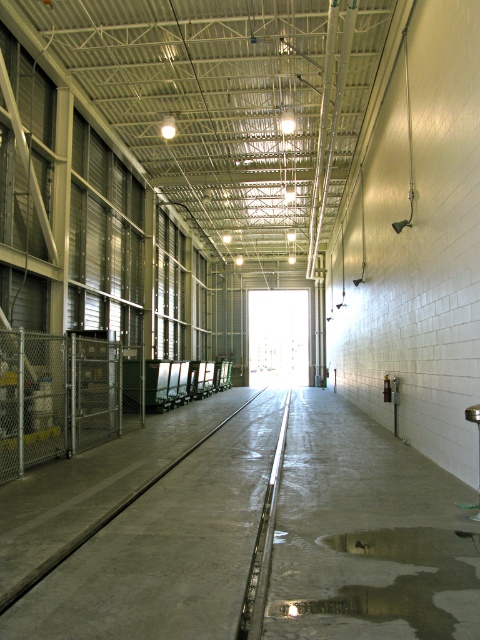
This screenshot has width=480, height=640. What do you see at coordinates (167, 548) in the screenshot?
I see `gray concrete rail at center` at bounding box center [167, 548].

Is gray concrete rail at center shorter than black metal rail at center?

Correct, gray concrete rail at center is not as tall as black metal rail at center.

This screenshot has width=480, height=640. What do you see at coordinates (167, 548) in the screenshot? I see `gray concrete rail at center` at bounding box center [167, 548].

Locate an element on the screen. This screenshot has width=480, height=640. gray concrete rail at center is located at coordinates 167,548.

Who is positioned more to the left, glossy concrete puddle at lower center or black metal rail at center?

black metal rail at center is more to the left.

The image size is (480, 640). Find the location of `glossy concrete puddle at lower center`. glossy concrete puddle at lower center is located at coordinates (399, 579).

Between point (360, 545) and point (282, 464), which one is positioned behind?

Positioned behind is point (282, 464).

Where is `glossy concrete puddle at lower center`? The image size is (480, 640). glossy concrete puddle at lower center is located at coordinates (399, 579).

This screenshot has height=640, width=480. What do you see at coordinates (167, 548) in the screenshot?
I see `gray concrete rail at center` at bounding box center [167, 548].

This screenshot has width=480, height=640. What are the coordinates of `gray concrete rail at center` in the screenshot? It's located at (167, 548).

Who is more forward, (182, 468) or (454, 620)?

Point (454, 620) is in front.

Identify the location of gray concrete rail at center. This screenshot has height=640, width=480. (167, 548).